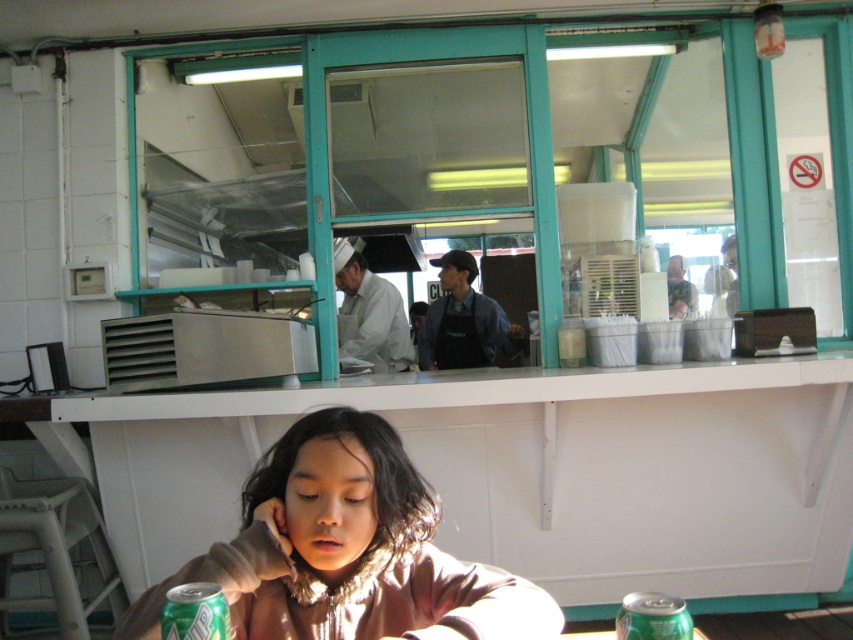
Question: Which of the following is the farthest from the observer?

Choices:
 (A) white plastic stool at lower left
 (B) white matte table at lower center

Answer: (B)

Question: Does white plastic stool at lower left appear on the right side of green matte can at lower right?

Choices:
 (A) no
 (B) yes

Answer: (A)

Question: Which of the following is the farthest from the observer?

Choices:
 (A) (200, 586)
 (B) (44, 525)
 (C) (252, 520)

Answer: (B)

Question: Observing the image, what is the correct spatial positioning of brown fuzzy jacket at lower center in reference to green matte can at lower right?

Choices:
 (A) right
 (B) left

Answer: (B)

Question: Based on their relative distances, which object is farther from the green matte can at lower left?

Choices:
 (A) white matte table at lower center
 (B) green matte can at lower right
 (C) white plastic stool at lower left

Answer: (B)

Question: Is white matte table at lower center smaller than brown fuzzy jacket at lower center?

Choices:
 (A) no
 (B) yes

Answer: (A)